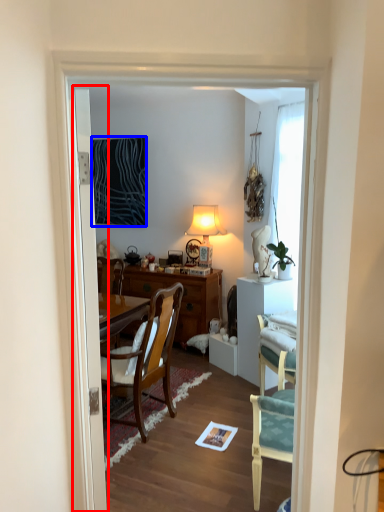
Question: Which of the following is the closest to the observer, door (highlighted by a red box) or picture frame (highlighted by a blue box)?

Choices:
 (A) door
 (B) picture frame

Answer: (A)